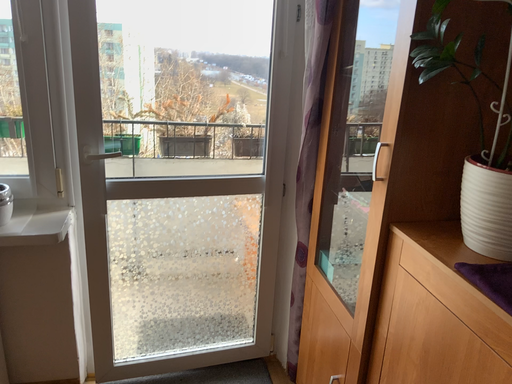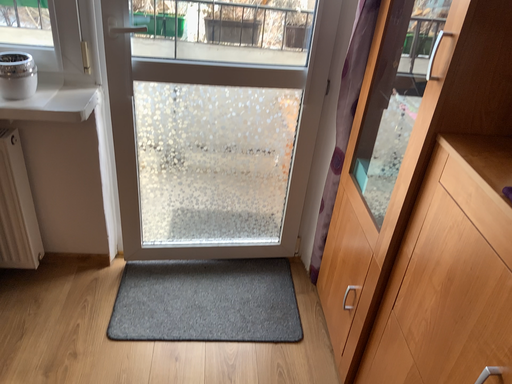
Question: Which way did the camera rotate in the video?

Choices:
 (A) rotated upward
 (B) rotated downward

Answer: (B)